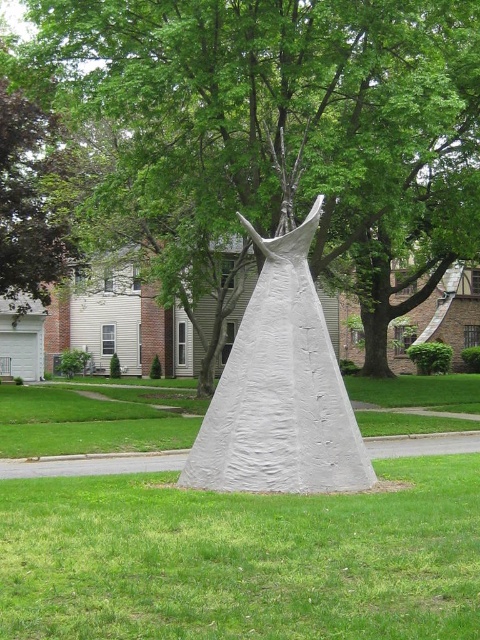
Is green leafy tree at center wider than white matte dress at center?

Yes.

Which is in front, point (404, 17) or point (310, 432)?

Point (310, 432) is in front.

Find the location of `green leafy tree at center`. green leafy tree at center is located at coordinates (297, 120).

Can you confirm if green leafy tree at center is wider than white textured cone at center?

Indeed, green leafy tree at center has a greater width compared to white textured cone at center.

Consider the image. Between green leafy tree at center and white textured cone at center, which one has less height?

white textured cone at center

Which is behind, point (362, 26) or point (0, 413)?

Positioned behind is point (0, 413).

Locate an element on the screen. green leafy tree at center is located at coordinates (297, 120).

Is white textured cone at center below white matte dress at center?

Indeed, white textured cone at center is positioned under white matte dress at center.

Can you confirm if white textured cone at center is smaller than white matte dress at center?

Incorrect, white textured cone at center is not smaller in size than white matte dress at center.

This screenshot has height=640, width=480. Describe the element at coordinates (241, 557) in the screenshot. I see `white textured cone at center` at that location.

The image size is (480, 640). Find the location of `white textured cone at center`. white textured cone at center is located at coordinates (241, 557).